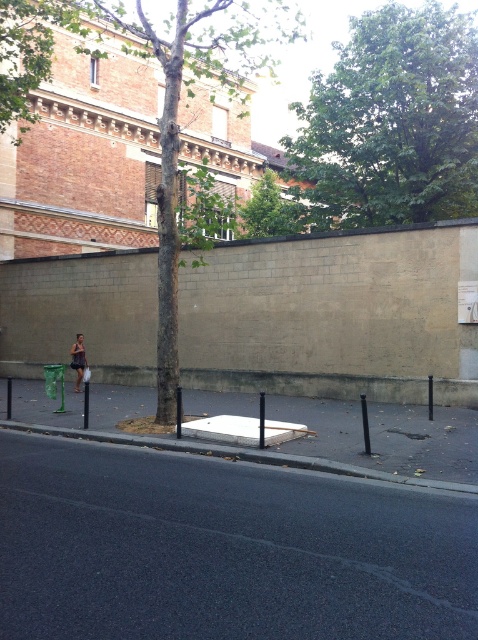
Consider the image. Who is positioned more to the left, green textured tree at center or gray concrete curb at lower center?

green textured tree at center

Between point (175, 253) and point (91, 436), which one is positioned behind?

Positioned behind is point (175, 253).

I want to click on green textured tree at center, so click(172, 116).

Does green leafy tree at center have a lesser width compared to dark brown leather bag at lower left?

No, green leafy tree at center is not thinner than dark brown leather bag at lower left.

Is green leafy tree at center further to camera compared to dark brown leather bag at lower left?

Yes, it is.

Which is in front, point (243, 218) or point (82, 344)?

Point (82, 344) is more forward.

Find the location of `green leafy tree at center`. green leafy tree at center is located at coordinates (271, 211).

Which is more to the right, green leafy tree at upper center or dark brown leather bag at lower left?

Positioned to the right is green leafy tree at upper center.

Identify the location of green leafy tree at upper center. (391, 122).

Image resolution: width=478 pixels, height=640 pixels. Find the location of `green leafy tree at upper center`. green leafy tree at upper center is located at coordinates (391, 122).